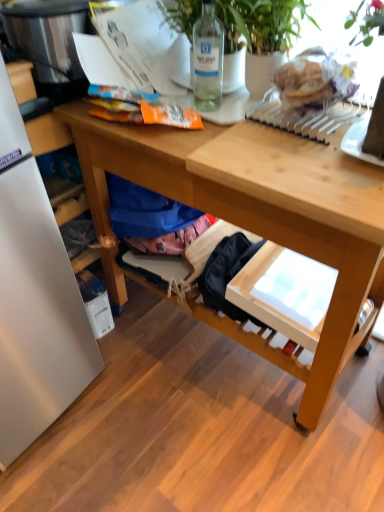
Question: Visually, is clear glass bottle at upper center positioned to the left or to the right of stainless steel appliance at left?

Choices:
 (A) right
 (B) left

Answer: (A)

Question: From their relative heights in the image, would you say clear glass bottle at upper center is taller or shorter than stainless steel appliance at left?

Choices:
 (A) tall
 (B) short

Answer: (A)

Question: Which object is positioned farthest from the clear glass bottle at upper center?

Choices:
 (A) green leafy plant at upper right
 (B) wooden desk at center
 (C) stainless steel appliance at left

Answer: (B)

Question: Which of these objects is positioned farthest from the wooden desk at center?

Choices:
 (A) stainless steel appliance at left
 (B) green leafy plant at upper right
 (C) clear glass bottle at upper center

Answer: (A)